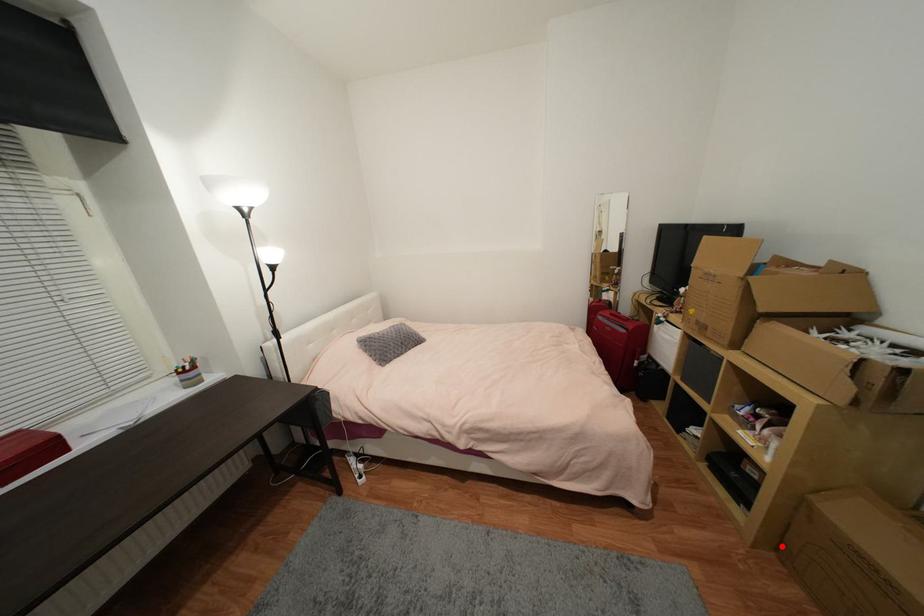
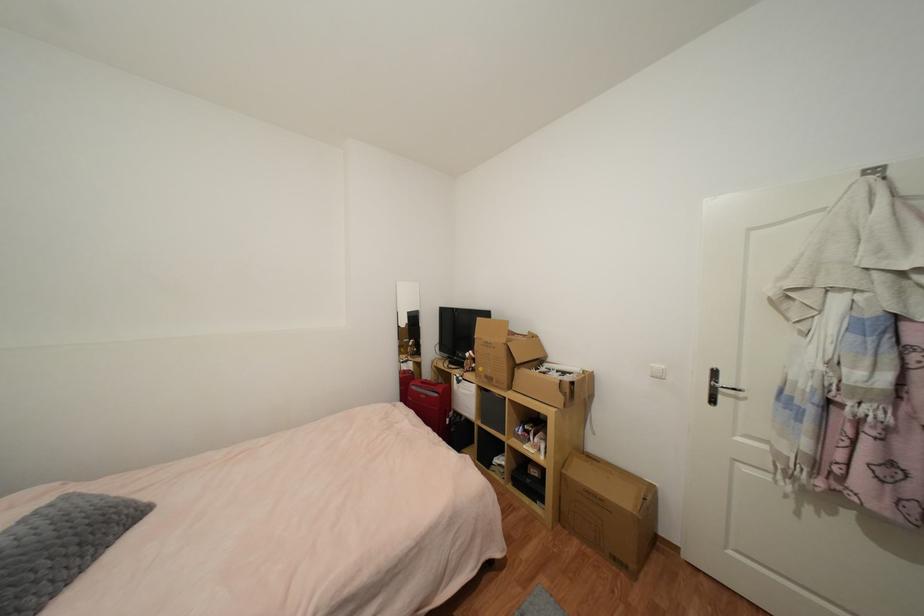
Question: I am providing you with two images of the same scene from different viewpoints. A red point is shown in image1. For the corresponding object point in image2, is it positioned nearer or farther from the camera?

Choices:
 (A) Nearer
 (B) Farther

Answer: (A)